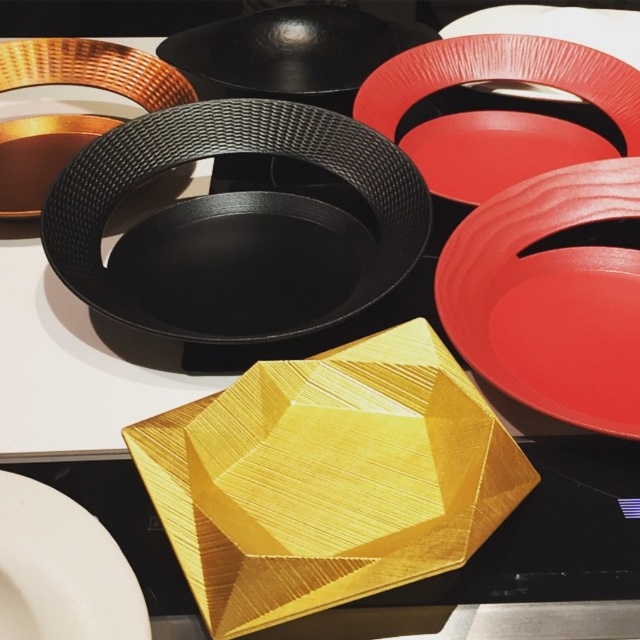
What do you see at coordinates (92, 68) in the screenshot? The image size is (640, 640). I see `matte black plate at upper center` at bounding box center [92, 68].

Can you confirm if matte black plate at upper center is taller than matte red plate at upper right?

Indeed, matte black plate at upper center has a greater height compared to matte red plate at upper right.

Does point (163, 77) come in front of point (506, 22)?

Yes.

In order to click on matte black plate at upper center in this screenshot , I will do `click(92, 68)`.

Is point (308, 236) positioned after point (468, 35)?

No, (308, 236) is in front of (468, 35).

Is black textured platter at center thinner than matte red platter at upper right?

Incorrect, black textured platter at center's width is not less than matte red platter at upper right's.

Is point (154, 307) farther from camera compared to point (532, 65)?

No, it is in front of (532, 65).

Identify the location of black textured platter at center. (234, 212).

Is point (118, 637) less distant than point (486, 29)?

Yes, point (118, 637) is in front of point (486, 29).

What are the coordinates of `white matte plate at lower left` in the screenshot? It's located at (61, 570).

The width and height of the screenshot is (640, 640). What are the coordinates of `white matte plate at lower left` in the screenshot? It's located at (61, 570).